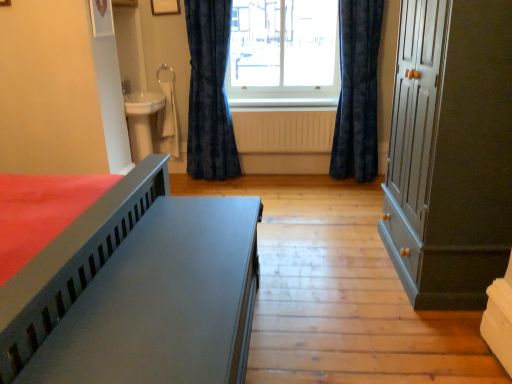
Question: Is matte gray cupboard at right outside matte gray bed at lower left?

Choices:
 (A) yes
 (B) no

Answer: (A)

Question: Can you confirm if matte gray cupboard at right is shorter than matte gray bed at lower left?

Choices:
 (A) yes
 (B) no

Answer: (B)

Question: Does matte gray cupboard at right lie in front of matte gray bed at lower left?

Choices:
 (A) yes
 (B) no

Answer: (B)

Question: Considering the relative sizes of matte gray cupboard at right and matte gray bed at lower left in the image provided, is matte gray cupboard at right thinner than matte gray bed at lower left?

Choices:
 (A) no
 (B) yes

Answer: (A)

Question: Is the depth of matte gray cupboard at right greater than that of matte gray bed at lower left?

Choices:
 (A) no
 (B) yes

Answer: (B)

Question: Is matte gray cupboard at right bigger than matte gray bed at lower left?

Choices:
 (A) no
 (B) yes

Answer: (B)

Question: Considering the relative sizes of yellow matte radiator at center and white wood at center in the image provided, is yellow matte radiator at center smaller than white wood at center?

Choices:
 (A) no
 (B) yes

Answer: (A)

Question: Considering the relative sizes of yellow matte radiator at center and white wood at center in the image provided, is yellow matte radiator at center wider than white wood at center?

Choices:
 (A) no
 (B) yes

Answer: (A)

Question: Could you tell me if yellow matte radiator at center is turned towards white wood at center?

Choices:
 (A) no
 (B) yes

Answer: (A)

Question: Can you confirm if yellow matte radiator at center is shorter than white wood at center?

Choices:
 (A) yes
 (B) no

Answer: (B)

Question: Is yellow matte radiator at center next to white wood at center and touching it?

Choices:
 (A) no
 (B) yes

Answer: (A)

Question: Is yellow matte radiator at center positioned far away from white wood at center?

Choices:
 (A) no
 (B) yes

Answer: (A)

Question: Can matte gray bed at lower left be found inside velvet dark blue curtain at center, positioned as the 1th curtain in right-to-left order?

Choices:
 (A) yes
 (B) no

Answer: (B)